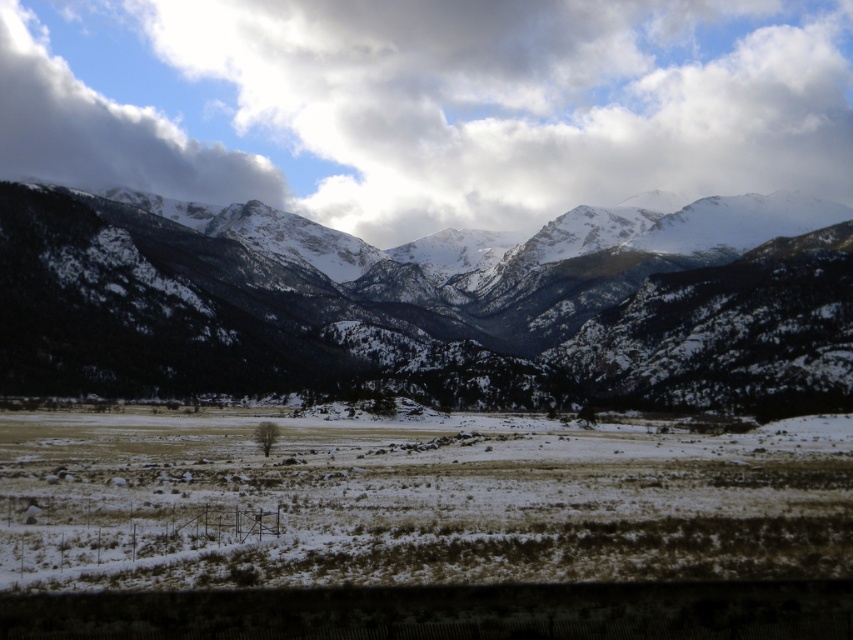
Question: Which object is closer to the camera taking this photo?

Choices:
 (A) white fluffy cloud at upper left
 (B) brown dry grass at center
 (C) snowy rock mountain range at upper center

Answer: (B)

Question: Which object is farther from the camera taking this photo?

Choices:
 (A) brown dry grass at center
 (B) white fluffy cloud at upper center
 (C) white fluffy cloud at upper left
 (D) snowy rock mountain range at upper center

Answer: (B)

Question: In this image, where is brown dry grass at center located relative to white fluffy cloud at upper left?

Choices:
 (A) right
 (B) left

Answer: (A)

Question: Considering the relative positions of snowy rock mountain range at upper center and white fluffy cloud at upper left in the image provided, where is snowy rock mountain range at upper center located with respect to white fluffy cloud at upper left?

Choices:
 (A) below
 (B) above

Answer: (A)

Question: Which point appears closest to the camera in this image?

Choices:
 (A) (38, 97)
 (B) (83, 19)

Answer: (A)

Question: In this image, where is brown dry grass at center located relative to white fluffy cloud at upper left?

Choices:
 (A) left
 (B) right

Answer: (B)